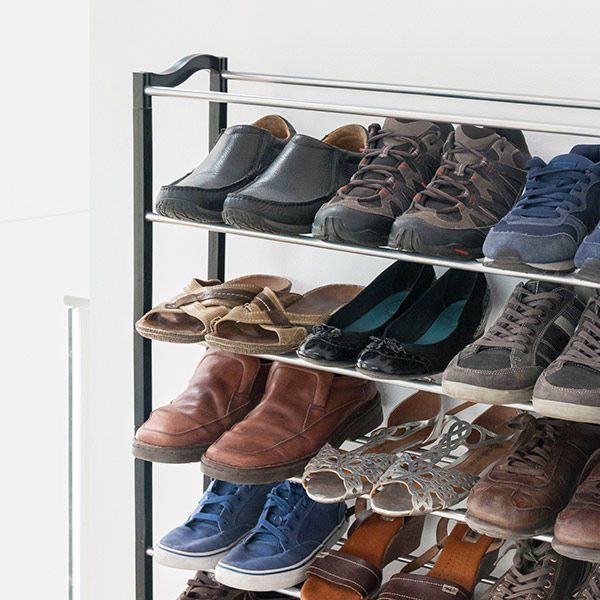
You are a GUI agent. You are given a task and a screenshot of the screen. Output one action in this format:
    pyautogui.click(x=<x>, y=<y>)
    Task: Click on the shoes top shelf
    
    Given the screenshot: What is the action you would take?
    pyautogui.click(x=206, y=171), pyautogui.click(x=281, y=170), pyautogui.click(x=381, y=181), pyautogui.click(x=450, y=194), pyautogui.click(x=542, y=207), pyautogui.click(x=590, y=256)